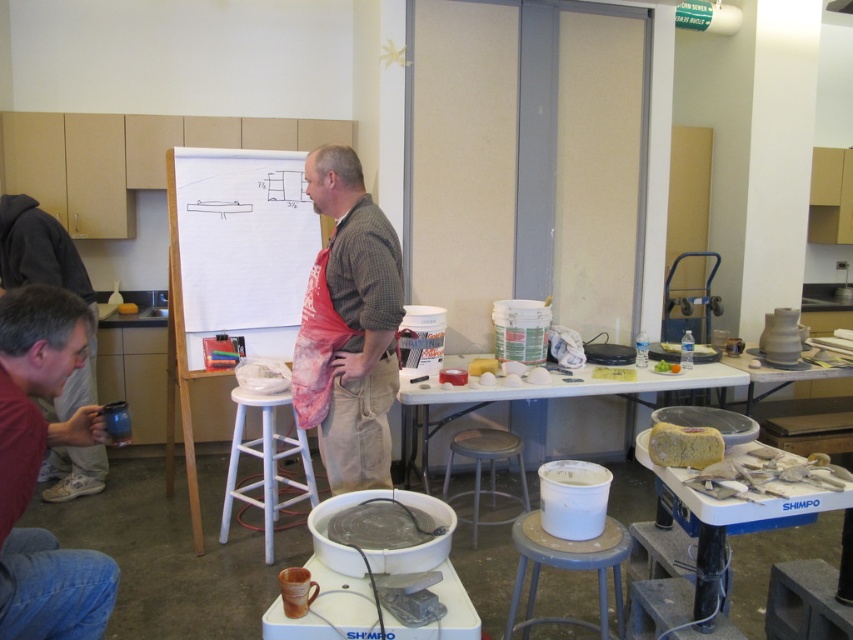
Question: Does red apron at center have a larger size compared to white plastic table at center?

Choices:
 (A) yes
 (B) no

Answer: (B)

Question: Is red matte mug at lower left below white plastic table at center?

Choices:
 (A) no
 (B) yes

Answer: (A)

Question: Which point is farther to the camera?

Choices:
 (A) (9, 266)
 (B) (386, 404)
 (C) (495, 452)
 (D) (274, 504)

Answer: (A)

Question: Which object appears closest to the camera in this image?

Choices:
 (A) white plastic stool at center
 (B) white glossy table at center
 (C) white plastic table at center

Answer: (A)

Question: Estimate the real-world distances between objects in this image. Which object is closer to the red matte mug at lower left?

Choices:
 (A) matte gray stool at center
 (B) white plastic table at center

Answer: (B)

Question: Does white plastic table at center have a greater width compared to matte gray stool at center?

Choices:
 (A) yes
 (B) no

Answer: (A)